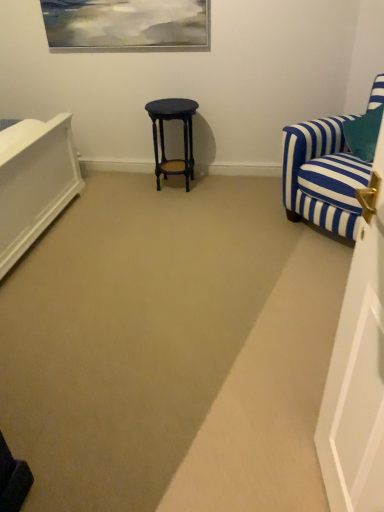
Question: Based on their sizes in the image, would you say matte black stool at center is bigger or smaller than blue striped fabric chair at right?

Choices:
 (A) big
 (B) small

Answer: (B)

Question: From a real-world perspective, relative to blue striped fabric chair at right, is matte black stool at center vertically above or below?

Choices:
 (A) below
 (B) above

Answer: (A)

Question: From the image's perspective, is matte black stool at center above or below blue striped fabric chair at right?

Choices:
 (A) above
 (B) below

Answer: (A)

Question: Looking at the image, does blue striped fabric chair at right seem bigger or smaller compared to matte black stool at center?

Choices:
 (A) big
 (B) small

Answer: (A)

Question: From a real-world perspective, relative to matte black stool at center, is blue striped fabric chair at right vertically above or below?

Choices:
 (A) above
 (B) below

Answer: (A)

Question: Is blue striped fabric chair at right wider or thinner than matte black stool at center?

Choices:
 (A) wide
 (B) thin

Answer: (A)

Question: Considering the positions of point (350, 162) and point (153, 117), is point (350, 162) closer or farther from the camera than point (153, 117)?

Choices:
 (A) farther
 (B) closer

Answer: (B)